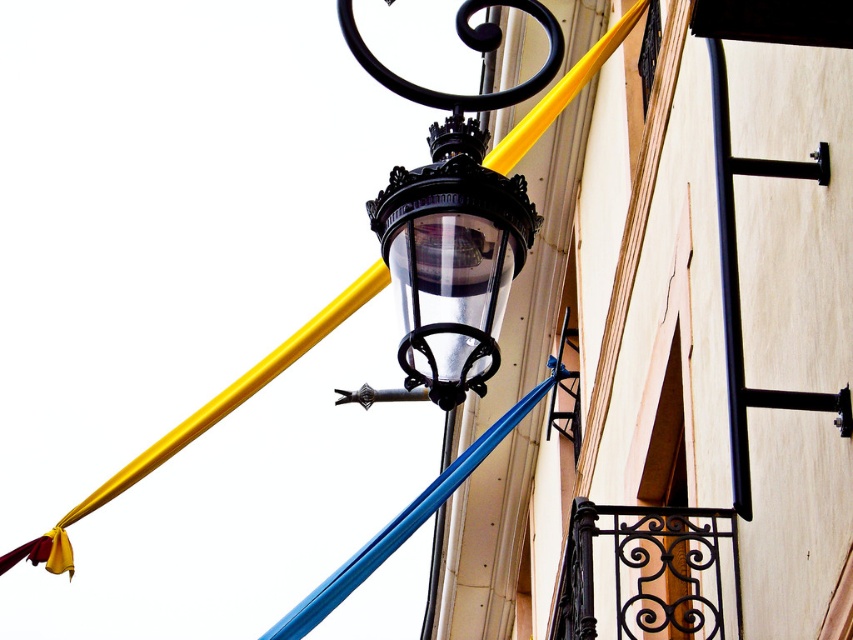
Question: Which of the following is the closest to the observer?

Choices:
 (A) (606, 54)
 (B) (457, 308)

Answer: (B)

Question: Among these points, which one is farthest from the camera?

Choices:
 (A) 561,104
 (B) 404,292

Answer: (A)

Question: Can you confirm if black glass lantern at center is positioned above black metal pole at upper center?

Choices:
 (A) no
 (B) yes

Answer: (B)

Question: In this image, where is black glass lantern at center located relative to black metal pole at upper center?

Choices:
 (A) above
 (B) below

Answer: (A)

Question: Where is black glass lantern at center located in relation to black metal pole at upper center in the image?

Choices:
 (A) right
 (B) left

Answer: (A)

Question: Which point is closer to the camera taking this photo?

Choices:
 (A) (13, 557)
 (B) (410, 244)

Answer: (B)